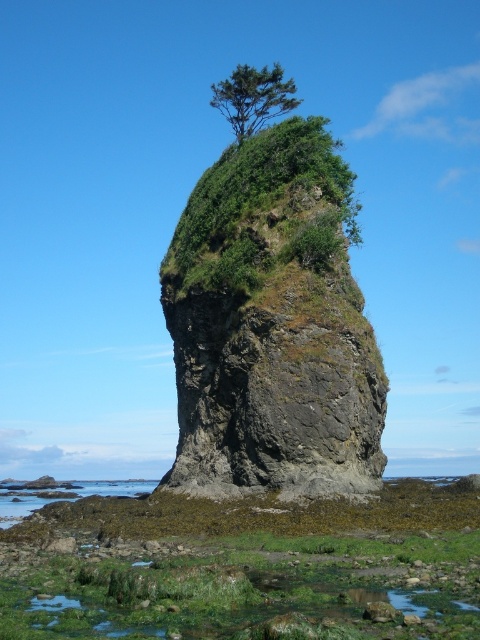
Question: Can you confirm if green mossy rock at center is positioned above green leafy tree at upper center?

Choices:
 (A) no
 (B) yes

Answer: (A)

Question: Which is farther from the green leafy tree at upper center?

Choices:
 (A) green mossy rock at center
 (B) green leafy vegetation at center

Answer: (A)

Question: Is green leafy vegetation at center thinner than green leafy tree at upper center?

Choices:
 (A) no
 (B) yes

Answer: (A)

Question: Observing the image, what is the correct spatial positioning of green leafy vegetation at center in reference to green leafy tree at upper center?

Choices:
 (A) right
 (B) left

Answer: (B)

Question: Which point is closer to the camera taking this photo?

Choices:
 (A) (222, 108)
 (B) (249, 168)

Answer: (B)

Question: Which point is closer to the camera?

Choices:
 (A) green mossy rock at center
 (B) green leafy tree at upper center
 (C) green leafy vegetation at center

Answer: (A)